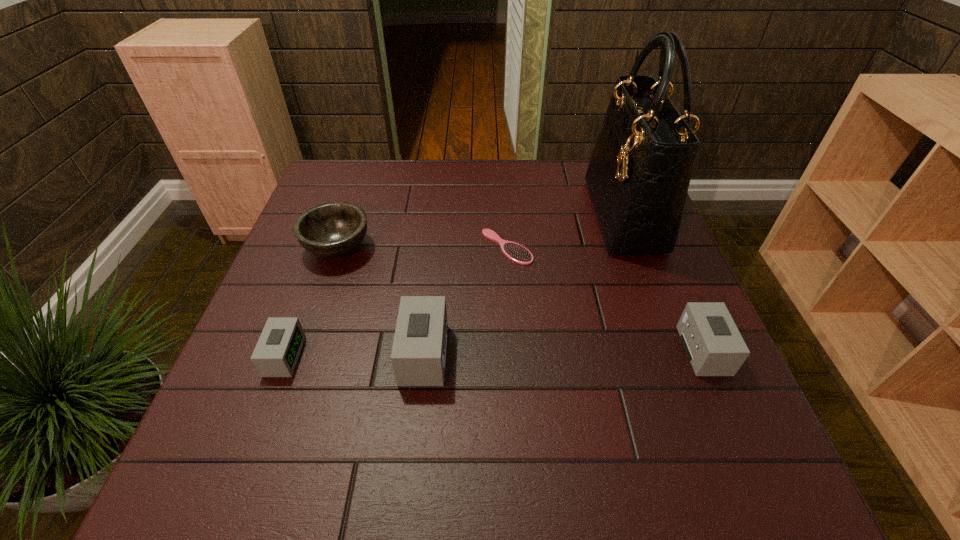
Locate an element on the screen. bowl situated at the left edge is located at coordinates (334, 229).

In order to click on alarm clock at the right edge in this screenshot , I will do `click(713, 344)`.

At what (x,y) coordinates should I click in order to perform the action: click on handbag located in the right edge section of the desktop. Please return your answer as a coordinate pair (x, y). The image size is (960, 540). Looking at the image, I should click on (639, 173).

Locate an element on the screen. object located in the far right corner section of the desktop is located at coordinates (639, 173).

This screenshot has height=540, width=960. In the image, there is a desktop. In order to click on vacant space at the far edge in this screenshot , I will do [461, 162].

Image resolution: width=960 pixels, height=540 pixels. In the image, there is a desktop. Find the location of `free space at the near edge`. free space at the near edge is located at coordinates (335, 394).

Image resolution: width=960 pixels, height=540 pixels. I want to click on vacant area at the left edge, so click(x=329, y=324).

The image size is (960, 540). In the image, there is a desktop. What are the coordinates of `vacant space at the near left corner` in the screenshot? It's located at (297, 428).

Find the location of a particular element. The width and height of the screenshot is (960, 540). vacant region between the rightmost alarm clock and the leftmost alarm clock is located at coordinates (493, 353).

In order to click on free spot between the second alarm clock from right to left and the tallest object in this screenshot , I will do `click(524, 285)`.